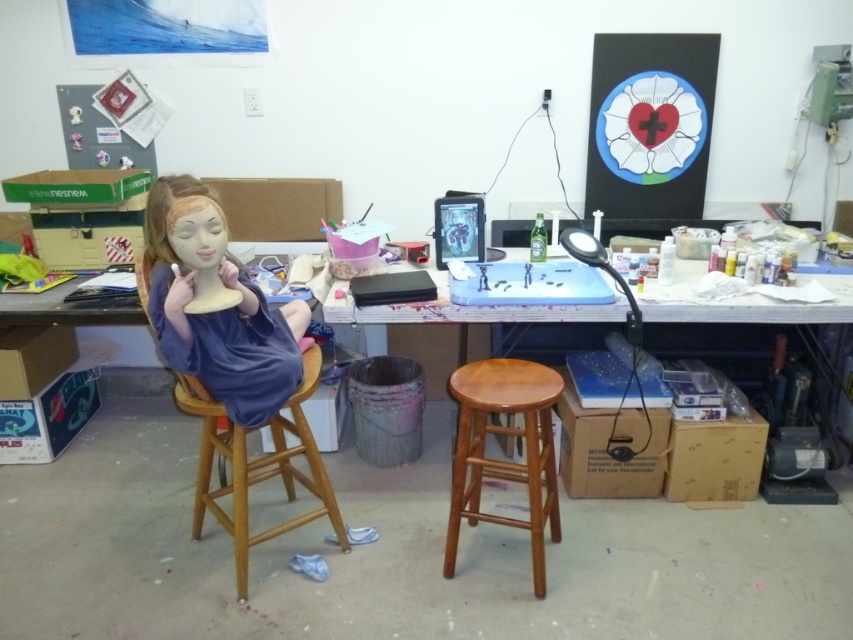
Question: Which object is closer to the camera taking this photo?

Choices:
 (A) light brown wood stool at center
 (B) wooden stool at center
 (C) wooden desk at center
 (D) velvet blue dress at center

Answer: (D)

Question: Which of the following is the closest to the observer?

Choices:
 (A) wooden stool at center
 (B) light brown wood stool at center
 (C) velvet blue dress at center
 (D) wooden desk at center

Answer: (C)

Question: Which object is farther from the camera taking this photo?

Choices:
 (A) velvet blue dress at center
 (B) wooden desk at center

Answer: (B)

Question: Does velvet blue dress at center appear over light brown wood stool at center?

Choices:
 (A) yes
 (B) no

Answer: (A)

Question: Where is light brown wood stool at center located in relation to wooden stool at center in the image?

Choices:
 (A) below
 (B) above

Answer: (A)

Question: Is the position of wooden stool at center more distant than that of wooden desk at center?

Choices:
 (A) yes
 (B) no

Answer: (B)